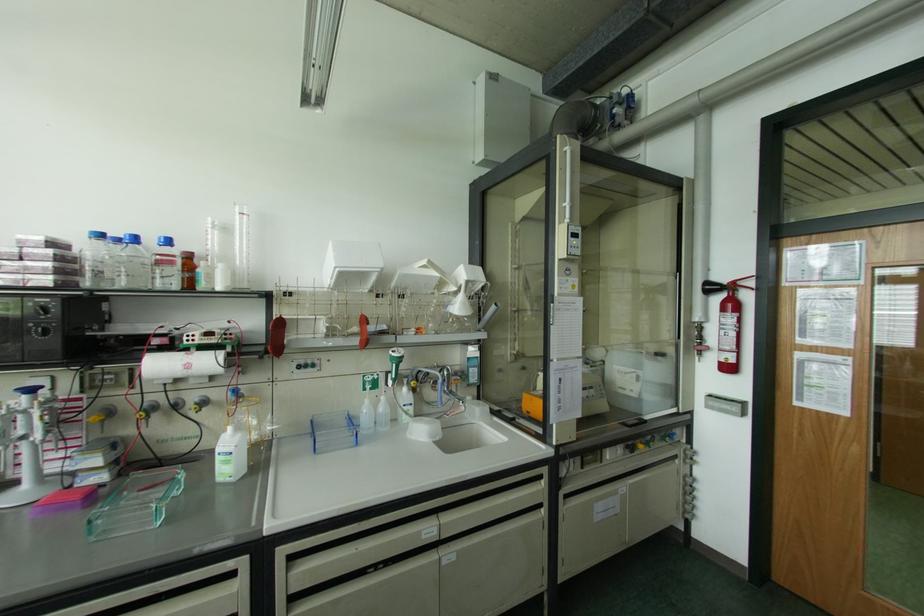
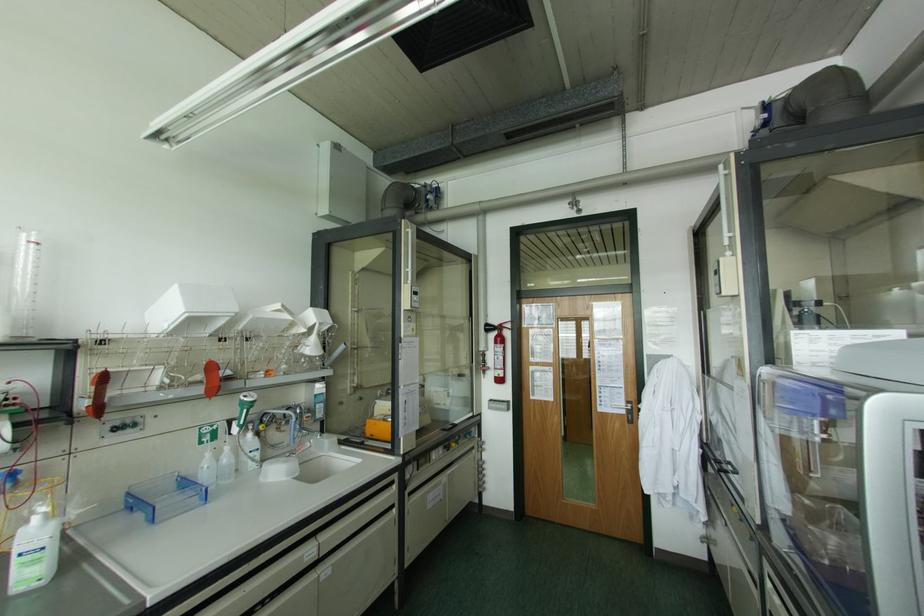
In the second image, find the point that corresponds to point 382,398 in the first image.

(226, 448)